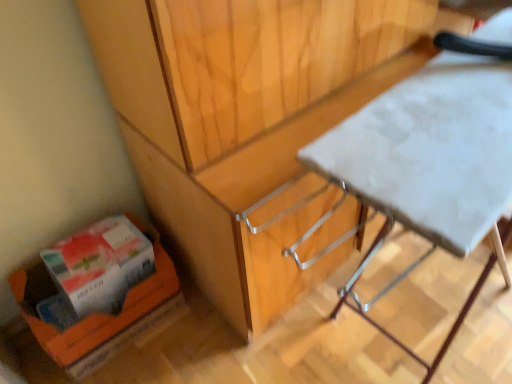
Image resolution: width=512 pixels, height=384 pixels. What are the coordinates of `white fabric table at center` in the screenshot? It's located at (430, 165).

Based on the photo, is orange cardboard box at lower left not close to orange cardboard box at lower left?

No.

Would you say orange cardboard box at lower left is outside orange cardboard box at lower left?

orange cardboard box at lower left lies outside orange cardboard box at lower left's area.

From a real-world perspective, does orange cardboard box at lower left stand above orange cardboard box at lower left?

No, from a real-world perspective, orange cardboard box at lower left is not over orange cardboard box at lower left

From a real-world perspective, is white fabric table at center located higher than orange cardboard box at lower left?

Yes.

Is white fabric table at center positioned beyond the bounds of orange cardboard box at lower left?

Yes, white fabric table at center is outside of orange cardboard box at lower left.

Can you confirm if white fabric table at center is thinner than orange cardboard box at lower left?

No, white fabric table at center is not thinner than orange cardboard box at lower left.

Does white fabric table at center turn towards orange cardboard box at lower left?

No, white fabric table at center does not turn towards orange cardboard box at lower left.

Can you confirm if white fabric table at center is positioned to the left of orange cardboard box at lower left?

Incorrect, white fabric table at center is not on the left side of orange cardboard box at lower left.

Is white fabric table at center closer to camera compared to orange cardboard box at lower left?

Yes, white fabric table at center is closer to the viewer.

Does white fabric table at center turn towards orange cardboard box at lower left?

No, white fabric table at center does not turn towards orange cardboard box at lower left.

Does white fabric table at center have a greater width compared to orange cardboard box at lower left?

Yes, white fabric table at center is wider than orange cardboard box at lower left.

In terms of width, does orange cardboard box at lower left look wider or thinner when compared to orange cardboard box at lower left?

Considering their sizes, orange cardboard box at lower left looks slimmer than orange cardboard box at lower left.

Based on the photo, which of these two, orange cardboard box at lower left or orange cardboard box at lower left, is smaller?

With smaller size is orange cardboard box at lower left.

Would you say orange cardboard box at lower left is to the left or to the right of orange cardboard box at lower left in the picture?

Clearly, orange cardboard box at lower left is on the right of orange cardboard box at lower left in the image.

From a real-world perspective, who is located lower, orange cardboard box at lower left or orange cardboard box at lower left?

orange cardboard box at lower left.

Is there a large distance between orange cardboard box at lower left and white fabric table at center?

No, there isn't a large distance between orange cardboard box at lower left and white fabric table at center.

Can you tell me how much orange cardboard box at lower left and white fabric table at center differ in facing direction?

The angular difference between orange cardboard box at lower left and white fabric table at center is 5.37 degrees.

Considering the sizes of objects orange cardboard box at lower left and white fabric table at center in the image provided, who is thinner, orange cardboard box at lower left or white fabric table at center?

orange cardboard box at lower left.

Which object is further away from the camera, orange cardboard box at lower left or white fabric table at center?

orange cardboard box at lower left.

Is orange cardboard box at lower left aimed at white fabric table at center?

No, orange cardboard box at lower left is not facing towards white fabric table at center.

In terms of size, does orange cardboard box at lower left appear bigger or smaller than white fabric table at center?

Considering their sizes, orange cardboard box at lower left takes up less space than white fabric table at center.

From the image's perspective, which is above, orange cardboard box at lower left or white fabric table at center?

white fabric table at center.

You are a GUI agent. You are given a task and a screenshot of the screen. Output one action in this format:
    pyautogui.click(x=<x>, y=<y>)
    Task: Click on the box on the right of orange cardboard box at lower left
    
    Given the screenshot: What is the action you would take?
    pyautogui.click(x=97, y=268)

At what (x,y) coordinates should I click in order to perform the action: click on table in front of the orange cardboard box at lower left. Please return your answer as a coordinate pair (x, y). The height and width of the screenshot is (384, 512). Looking at the image, I should click on (430, 165).

From the image, which object appears to be nearer to white fabric table at center, orange cardboard box at lower left or orange cardboard box at lower left?

orange cardboard box at lower left lies closer to white fabric table at center than the other object.

Considering their positions, is white fabric table at center positioned further to orange cardboard box at lower left than orange cardboard box at lower left?

The object further to orange cardboard box at lower left is white fabric table at center.

Considering their positions, is orange cardboard box at lower left positioned closer to orange cardboard box at lower left than white fabric table at center?

Based on the image, orange cardboard box at lower left appears to be nearer to orange cardboard box at lower left.

When comparing their distances from white fabric table at center, does orange cardboard box at lower left or orange cardboard box at lower left seem further?

orange cardboard box at lower left is positioned further to the anchor white fabric table at center.

Looking at this image, from the image, which object appears to be nearer to orange cardboard box at lower left, orange cardboard box at lower left or white fabric table at center?

orange cardboard box at lower left is closer to orange cardboard box at lower left.

Estimate the real-world distances between objects in this image. Which object is closer to orange cardboard box at lower left, white fabric table at center or orange cardboard box at lower left?

orange cardboard box at lower left lies closer to orange cardboard box at lower left than the other object.

The width and height of the screenshot is (512, 384). Identify the location of box located between orange cardboard box at lower left and white fabric table at center in the left-right direction. (97, 268).